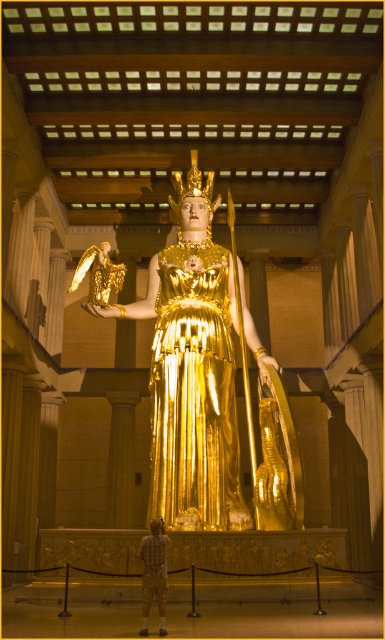
You are a visitor in the museum and want to take a photo of the plaid shirt at center without the gold reflective statue at center appearing in the shot. Is this possible given their current positions?

The plaid shirt at center is behind the gold reflective statue at center, so it is not possible to take a photo of the plaid shirt at center without the gold reflective statue at center appearing in the shot.

You are standing in the center of the grand hall and want to take a photo of the gold reflective statue at center. To avoid reflections from the floor, you need to stand at least 1 meter away from the statue. Is the statue positioned in a way that allows you to do so without moving past the columns?

The gold reflective statue at center is positioned at point [194,369], which is likely within the central area of the hall. Since the columns are part of the background structure and the statue is at the center, you can stand 1 meter away from it without needing to move past the columns for the photo.